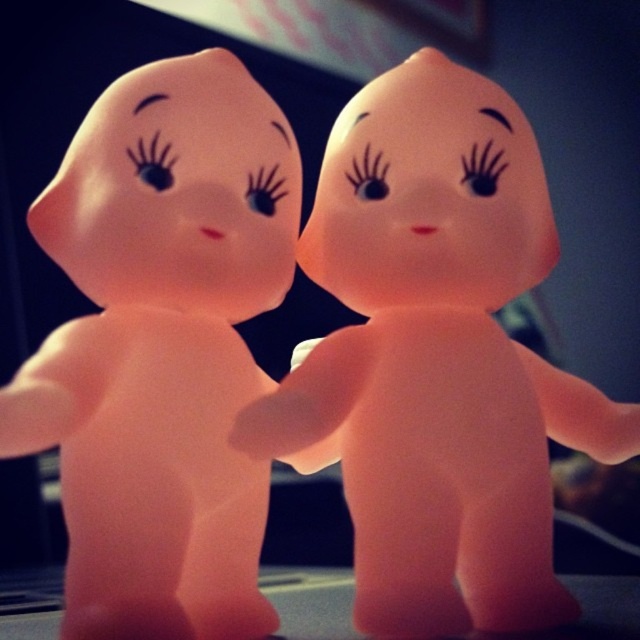
Question: Which of the following is the farthest from the observer?

Choices:
 (A) (16, 385)
 (B) (561, 621)

Answer: (B)

Question: Where is pink rubber doll at center located in relation to pink rubber figurine at center in the image?

Choices:
 (A) right
 (B) left

Answer: (A)

Question: Does pink rubber doll at center have a larger size compared to pink rubber figurine at center?

Choices:
 (A) no
 (B) yes

Answer: (B)

Question: Is pink rubber doll at center below pink rubber figurine at center?

Choices:
 (A) no
 (B) yes

Answer: (B)

Question: Which point is closer to the camera?

Choices:
 (A) pink rubber doll at center
 (B) pink rubber figurine at center

Answer: (B)